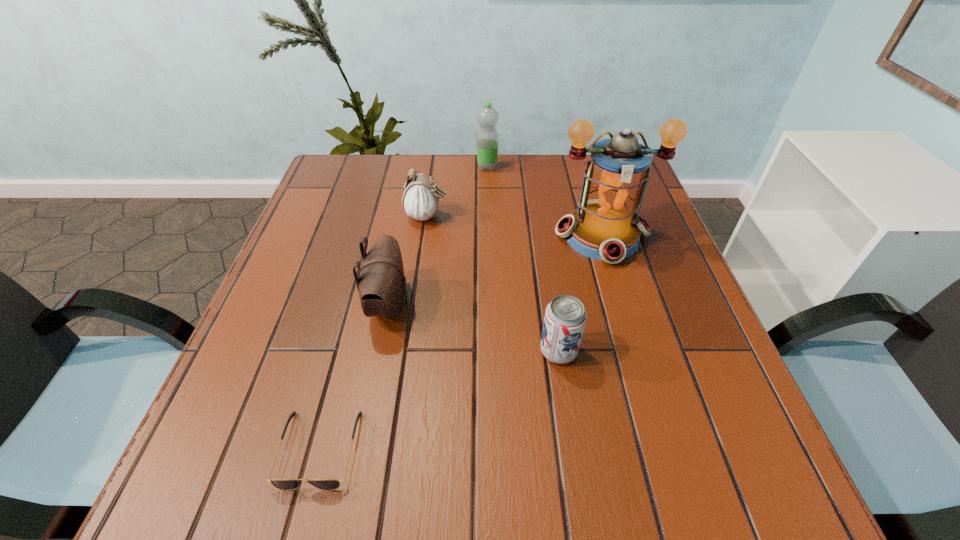
Identify the location of empty space that is in between the sunglasses and the tallest object. (461, 342).

Locate an element on the screen. vacant area between the shortest object and the lantern is located at coordinates (461, 342).

The width and height of the screenshot is (960, 540). Find the location of `vacant area that lies between the farther pouch and the water bottle`. vacant area that lies between the farther pouch and the water bottle is located at coordinates [x=458, y=192].

Image resolution: width=960 pixels, height=540 pixels. I want to click on free point between the sunglasses and the nearer pouch, so click(354, 376).

Where is `object that is the fourth closest one to the nearer pouch`? This screenshot has height=540, width=960. object that is the fourth closest one to the nearer pouch is located at coordinates (606, 226).

You are a GUI agent. You are given a task and a screenshot of the screen. Output one action in this format:
    pyautogui.click(x=<x>, y=<y>)
    Task: Click on the second closest object to the farther pouch
    
    Given the screenshot: What is the action you would take?
    pyautogui.click(x=487, y=138)

Find the location of `vacant space that satisfies the following two spatial constraints: 1. with the flap open on the nearer pouch; 2. on the left side of the beer can`. vacant space that satisfies the following two spatial constraints: 1. with the flap open on the nearer pouch; 2. on the left side of the beer can is located at coordinates (379, 352).

Where is `free spot that satisfies the following two spatial constraints: 1. on the front-facing side of the tallest object; 2. with the flap open on the nearer pouch`? free spot that satisfies the following two spatial constraints: 1. on the front-facing side of the tallest object; 2. with the flap open on the nearer pouch is located at coordinates [622, 304].

Image resolution: width=960 pixels, height=540 pixels. In order to click on vacant region that satisfies the following two spatial constraints: 1. on the front-facing side of the lantern; 2. with the flap open on the nearer pouch in this screenshot , I will do `click(622, 304)`.

Identify the location of free space in the image that satisfies the following two spatial constraints: 1. with the flap open on the nearer pouch; 2. on the back side of the beer can. The height and width of the screenshot is (540, 960). (379, 352).